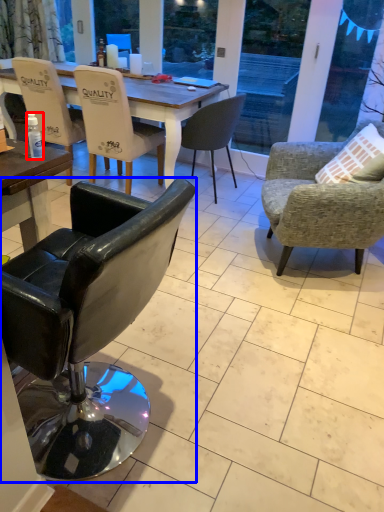
Question: Which object appears farthest to the camera in this image, bottle (highlighted by a red box) or chair (highlighted by a blue box)?

Choices:
 (A) bottle
 (B) chair

Answer: (A)